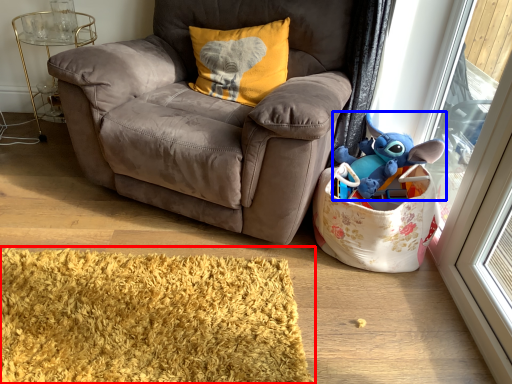
Question: Which object appears closest to the camera in this image, mat (highlighted by a red box) or toy (highlighted by a blue box)?

Choices:
 (A) mat
 (B) toy

Answer: (A)